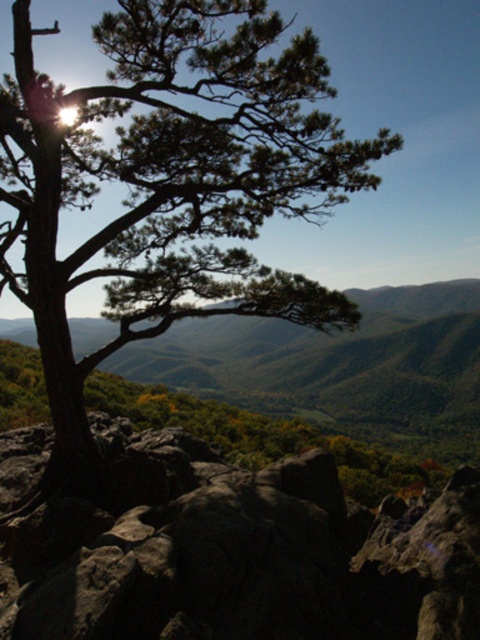
Question: Among these objects, which one is farthest from the camera?

Choices:
 (A) green needle-like tree at center
 (B) rough textured rock at center

Answer: (A)

Question: Is green needle-like tree at center behind rough textured rock at center?

Choices:
 (A) no
 (B) yes

Answer: (B)

Question: Does green needle-like tree at center appear on the left side of rough textured rock at center?

Choices:
 (A) yes
 (B) no

Answer: (A)

Question: Which of the following is the closest to the observer?

Choices:
 (A) (348, 625)
 (B) (31, 200)

Answer: (A)

Question: Among these objects, which one is nearest to the camera?

Choices:
 (A) rough textured rock at center
 (B) green needle-like tree at center

Answer: (A)

Question: Can you confirm if green needle-like tree at center is positioned to the right of rough textured rock at center?

Choices:
 (A) yes
 (B) no

Answer: (B)